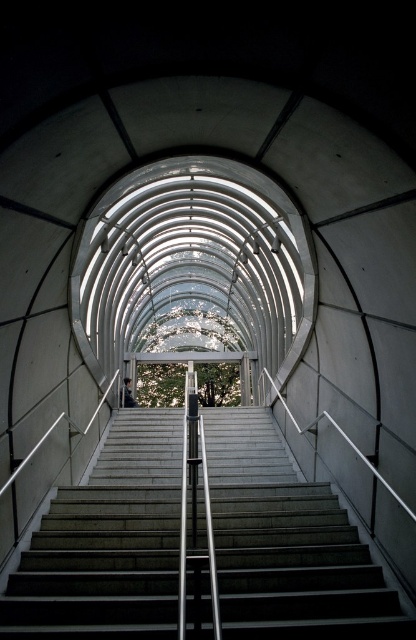
Is concrete stairs at center positioned behind dark gray fabric jacket at center?

No, it is not.

Does concrete stairs at center have a lesser height compared to dark gray fabric jacket at center?

Yes, concrete stairs at center is shorter than dark gray fabric jacket at center.

Is point (89, 490) closer to viewer compared to point (126, 381)?

Yes.

The height and width of the screenshot is (640, 416). I want to click on concrete stairs at center, so point(287,545).